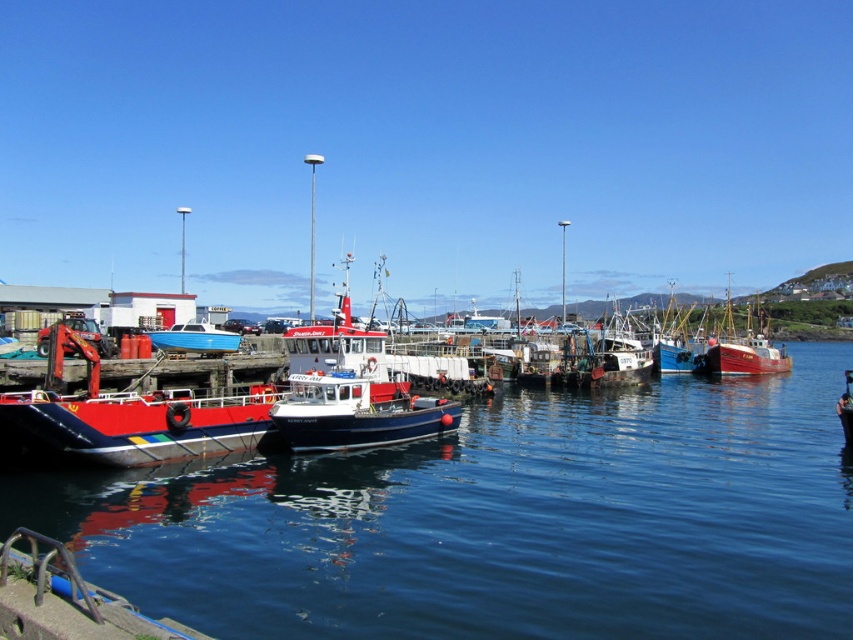
Question: Which point is closer to the camera taking this photo?

Choices:
 (A) (778, 368)
 (B) (595, 371)

Answer: (B)

Question: Which point is closer to the camera taking this photo?

Choices:
 (A) (682, 428)
 (B) (711, 358)
 (C) (230, 332)
 (D) (668, 358)

Answer: (A)

Question: Does blue water at center have a larger size compared to red wooden boat at center?

Choices:
 (A) yes
 (B) no

Answer: (B)

Question: Which point is closer to the camera taking this photo?

Choices:
 (A) (757, 358)
 (B) (683, 372)
 (C) (709, 564)

Answer: (C)

Question: Can you confirm if white glossy boat at center is positioned above red wooden boat at center?

Choices:
 (A) yes
 (B) no

Answer: (B)

Question: Is white glossy boat at center bigger than red matte boat at left?

Choices:
 (A) no
 (B) yes

Answer: (B)